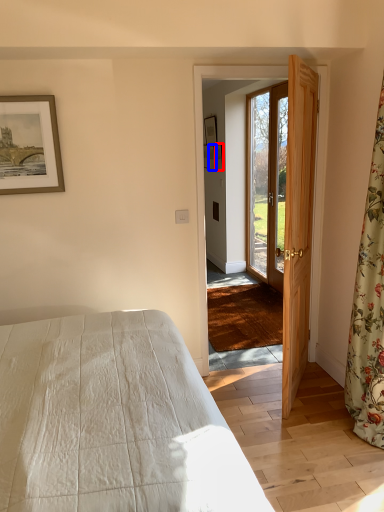
Question: Which object is further to the camera taking this photo, picture frame (highlighted by a red box) or picture frame (highlighted by a blue box)?

Choices:
 (A) picture frame
 (B) picture frame

Answer: (B)